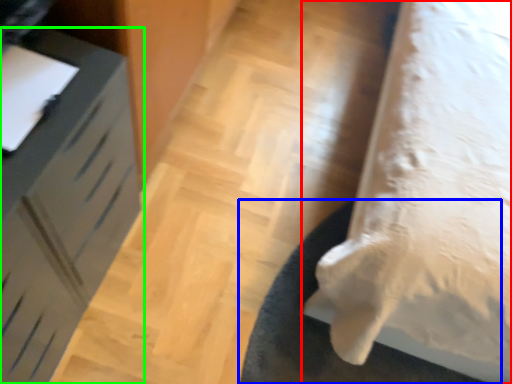
Question: Estimate the real-world distances between objects in this image. Which object is farther from furniture (highlighted by a red box), mat (highlighted by a blue box) or furniture (highlighted by a green box)?

Choices:
 (A) mat
 (B) furniture

Answer: (B)